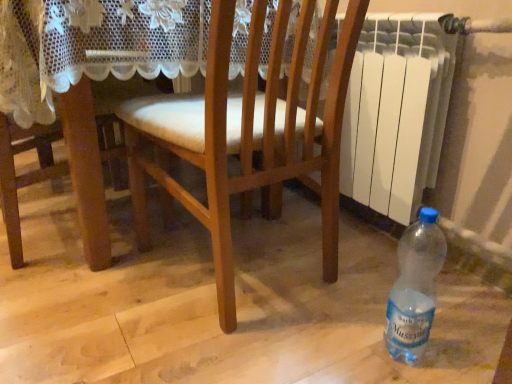
Question: Visually, is white plastic radiator at right positioned to the left or to the right of translucent plastic bottle at lower right?

Choices:
 (A) left
 (B) right

Answer: (B)

Question: Is white plastic radiator at right spatially inside translucent plastic bottle at lower right, or outside of it?

Choices:
 (A) outside
 (B) inside

Answer: (A)

Question: Estimate the real-world distances between objects in this image. Which object is closer to the white plastic radiator at right?

Choices:
 (A) translucent plastic bottle at lower right
 (B) wooden chair at center

Answer: (B)

Question: Based on their relative distances, which object is farther from the white plastic radiator at right?

Choices:
 (A) translucent plastic bottle at lower right
 (B) wooden chair at center

Answer: (A)